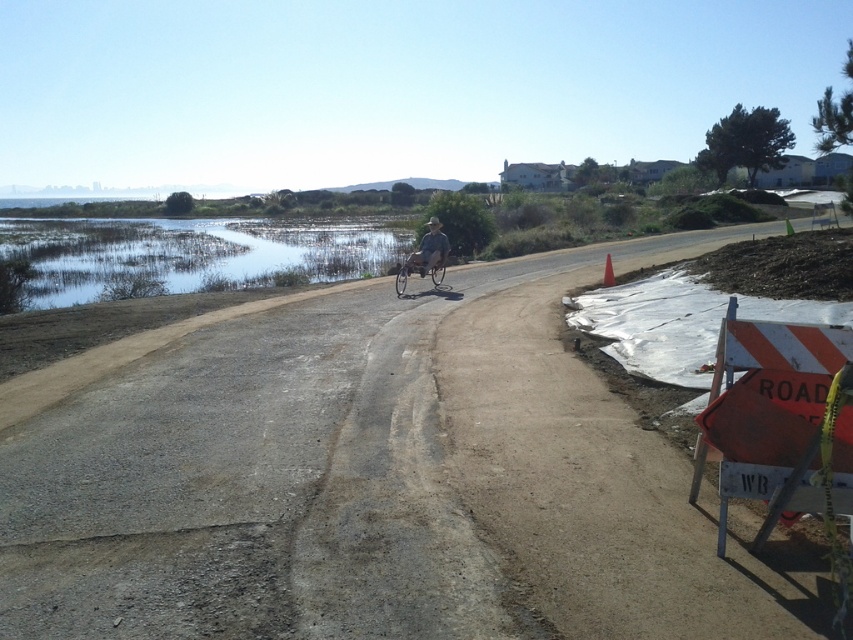
Can you confirm if clear water at center is bigger than silver metallic bicycle at center?

Correct, clear water at center is larger in size than silver metallic bicycle at center.

Does clear water at center appear over silver metallic bicycle at center?

Indeed, clear water at center is positioned over silver metallic bicycle at center.

This screenshot has width=853, height=640. Find the location of `clear water at center`. clear water at center is located at coordinates (190, 253).

Identify the location of clear water at center. (190, 253).

Who is more distant from viewer, (340, 324) or (328, 253)?

Point (328, 253)

Is point (555, 260) positioned after point (393, 237)?

That is False.

Describe the element at coordinates (374, 481) in the screenshot. The width and height of the screenshot is (853, 640). I see `dull gray asphalt at center` at that location.

Locate an element on the screen. dull gray asphalt at center is located at coordinates (374, 481).

Which is below, dull gray asphalt at center or silver metallic bicycle at center?

dull gray asphalt at center is below.

Between point (555, 552) and point (412, 266), which one is positioned behind?

The point (412, 266) is more distant.

The width and height of the screenshot is (853, 640). Describe the element at coordinates (374, 481) in the screenshot. I see `dull gray asphalt at center` at that location.

Find the location of `dull gray asphalt at center`. dull gray asphalt at center is located at coordinates (374, 481).